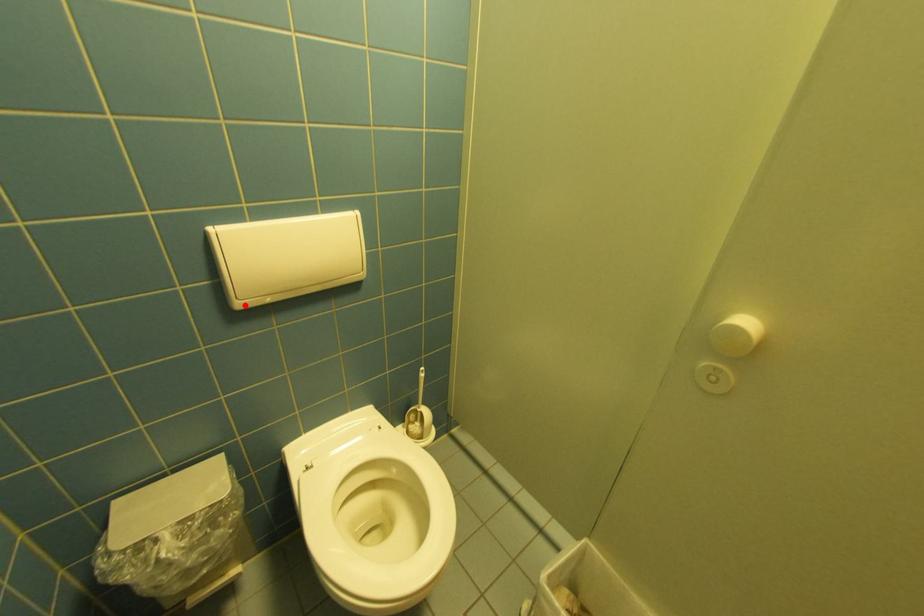
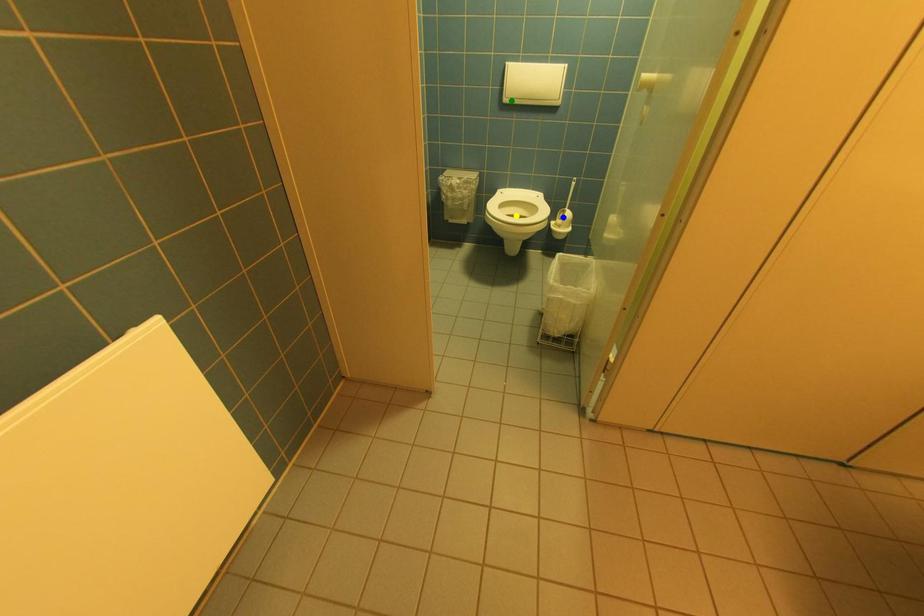
Question: I am providing you with two images of the same scene from different viewpoints. A red point is marked on the first image. You are given multiple points on the second image. Which point in image 2 is actually the same real-world point as the red point in image 1?

Choices:
 (A) yellow point
 (B) blue point
 (C) green point

Answer: (C)